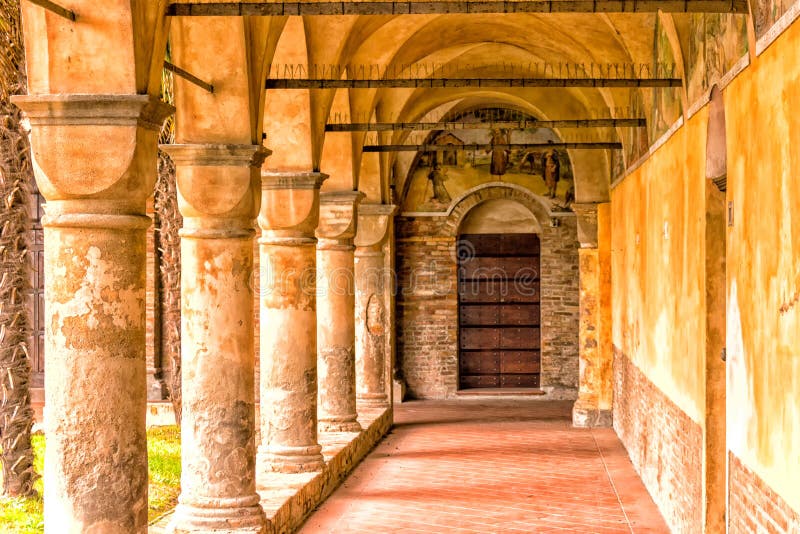
Identify the location of brick wall. The height and width of the screenshot is (534, 800). (664, 459).